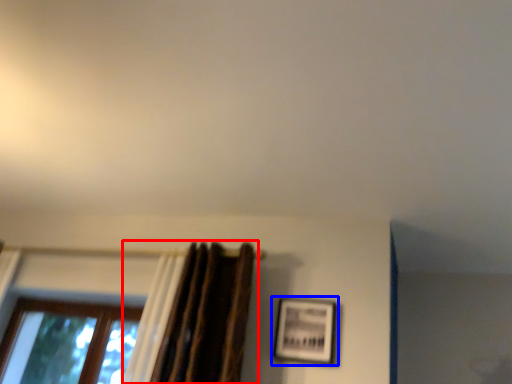
Question: Which of the following is the closest to the observer, curtain (highlighted by a red box) or picture frame (highlighted by a blue box)?

Choices:
 (A) curtain
 (B) picture frame

Answer: (A)